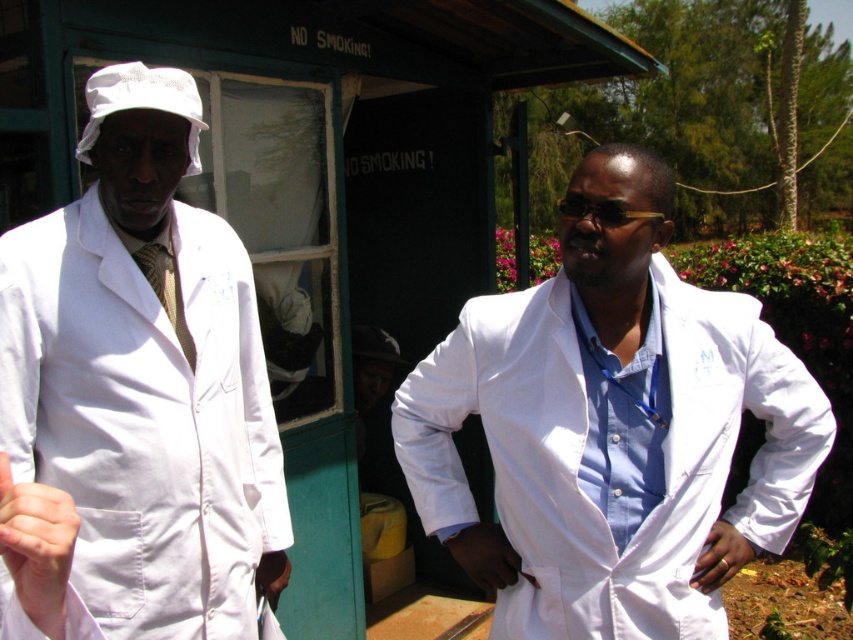
You are a delivery person needing to pass between the white matte lab coat at left and the white matte lab coat at right. The delivery cart you are pushing is 24 inches wide. Can you fit through the space between them?

The white matte lab coat at right is 26.73 inches away from the white matte lab coat at left, so yes, the delivery cart which is 24 inches wide can fit through the space between them since it is narrower than the distance between the two lab coats.